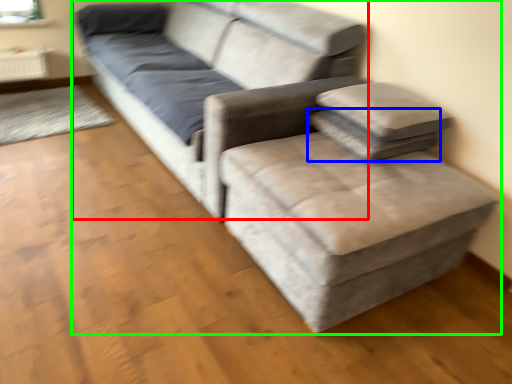
Question: Which is nearer to the couch (highlighted by a red box)? pillow (highlighted by a blue box) or studio couch (highlighted by a green box).

Choices:
 (A) pillow
 (B) studio couch

Answer: (B)